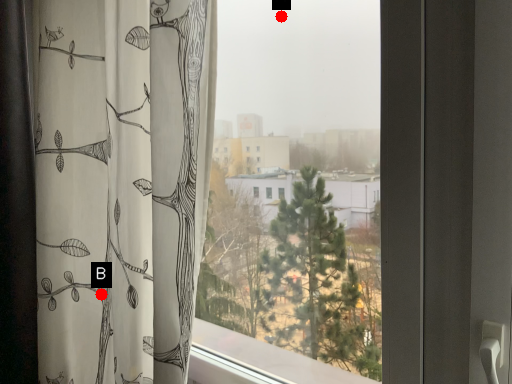
Question: Two points are circled on the image, labeled by A and B beside each circle. Among these points, which one is nearest to the camera?

Choices:
 (A) A is closer
 (B) B is closer

Answer: (A)